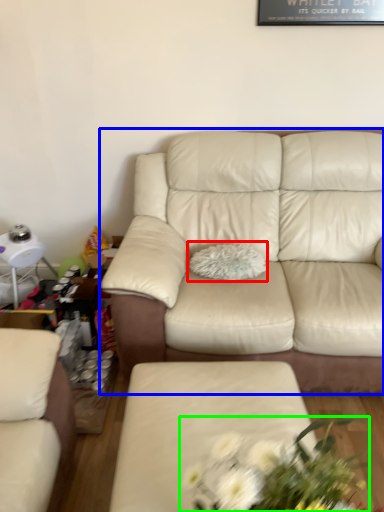
Question: Considering the real-world distances, which object is farthest from pillow (highlighted by a red box)? studio couch (highlighted by a blue box) or floral arrangement (highlighted by a green box)?

Choices:
 (A) studio couch
 (B) floral arrangement

Answer: (B)